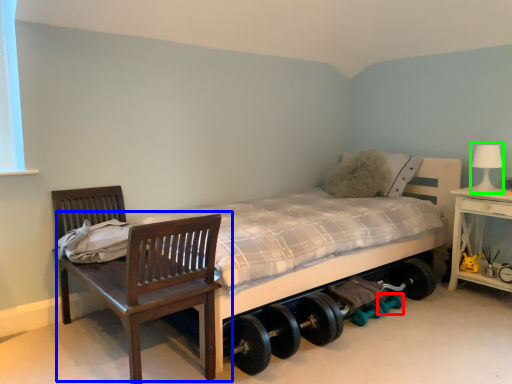
Question: Estimate the real-world distances between objects in this image. Which object is farther from dumbbell (highlighted by a red box), chair (highlighted by a blue box) or table lamp (highlighted by a green box)?

Choices:
 (A) chair
 (B) table lamp

Answer: (A)